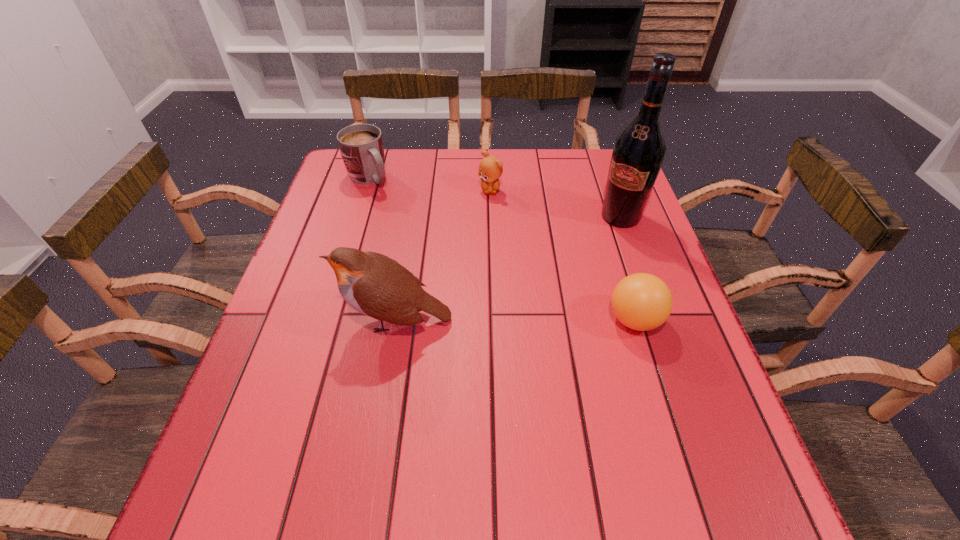
At what (x,y) coordinates should I click in order to perform the action: click on object that is the second closest to the wine bottle. Please return your answer as a coordinate pair (x, y). The height and width of the screenshot is (540, 960). Looking at the image, I should click on click(490, 168).

In order to click on vacant area in the image that satisfies the following two spatial constraints: 1. on the front side of the ping-pong ball; 2. on the side with brand of the third object from left to right in this screenshot , I will do `click(493, 320)`.

At what (x,y) coordinates should I click in order to perform the action: click on vacant space that satisfies the following two spatial constraints: 1. on the front side of the teddy bear; 2. on the right side of the wine bottle. Please return your answer as a coordinate pair (x, y). The image size is (960, 540). Looking at the image, I should click on (491, 217).